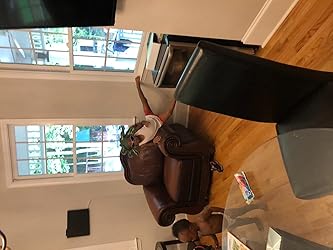
This screenshot has width=333, height=250. I want to click on window frame, so click(85, 178), click(85, 76), click(79, 120).